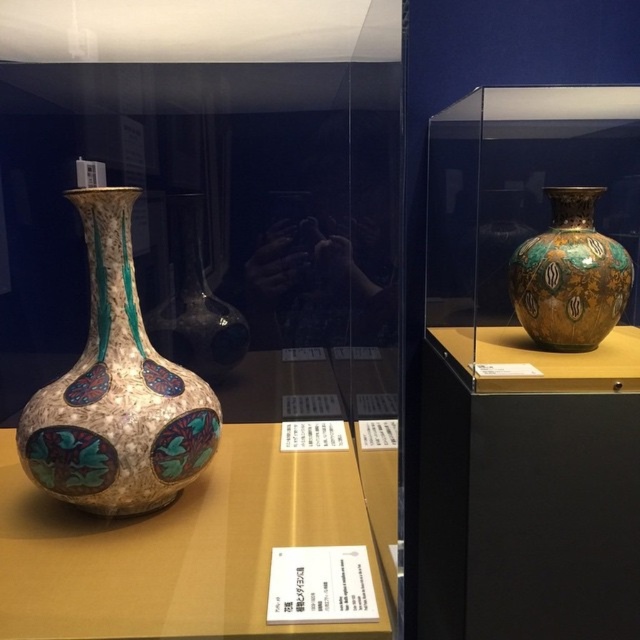
Can you confirm if enamel vase at left is thinner than gold and turquoise mosaic vase at right?

No.

Locate an element on the screen. The height and width of the screenshot is (640, 640). enamel vase at left is located at coordinates (116, 392).

How far apart are matte ceramic vase at lower left and enamel vase at center?

matte ceramic vase at lower left and enamel vase at center are 42.42 centimeters apart from each other.

Who is taller, matte ceramic vase at lower left or enamel vase at center?

With more height is enamel vase at center.

Locate an element on the screen. matte ceramic vase at lower left is located at coordinates (179, 548).

This screenshot has width=640, height=640. I want to click on matte ceramic vase at lower left, so click(x=179, y=548).

Can you confirm if gold metallic vase at center is positioned below enamel vase at center?

Indeed, gold metallic vase at center is positioned under enamel vase at center.

Identify the location of gold metallic vase at center. Image resolution: width=640 pixels, height=640 pixels. (529, 371).

The height and width of the screenshot is (640, 640). I want to click on gold metallic vase at center, so click(529, 371).